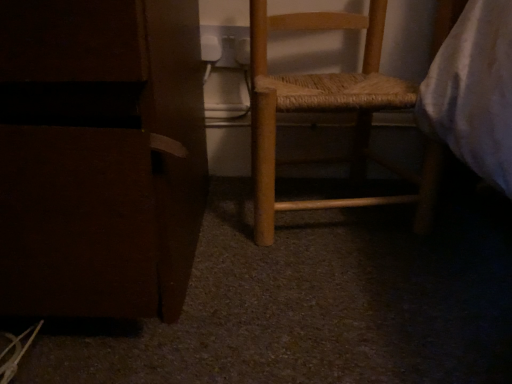
The width and height of the screenshot is (512, 384). Describe the element at coordinates (329, 111) in the screenshot. I see `wooden woven seat at center, marked as the 2th furniture in a left-to-right arrangement` at that location.

Locate an element on the screen. wooden woven seat at center, marked as the 2th furniture in a left-to-right arrangement is located at coordinates (329, 111).

Where is `matte brown cabinet at left, placed as the first furniture when sorted from left to right`? Image resolution: width=512 pixels, height=384 pixels. matte brown cabinet at left, placed as the first furniture when sorted from left to right is located at coordinates (100, 156).

Describe the element at coordinates (100, 156) in the screenshot. I see `matte brown cabinet at left, placed as the 2th furniture when sorted from right to left` at that location.

Where is `wooden woven seat at center, marked as the 2th furniture in a left-to-right arrangement`? The image size is (512, 384). wooden woven seat at center, marked as the 2th furniture in a left-to-right arrangement is located at coordinates (329, 111).

Consider the image. Is wooden woven seat at center, arranged as the 1th furniture when viewed from the right, to the left of matte brown cabinet at left, placed as the 2th furniture when sorted from right to left, from the viewer's perspective?

In fact, wooden woven seat at center, arranged as the 1th furniture when viewed from the right, is to the right of matte brown cabinet at left, placed as the 2th furniture when sorted from right to left.

In the image, is wooden woven seat at center, marked as the 2th furniture in a left-to-right arrangement, positioned in front of or behind matte brown cabinet at left, placed as the 2th furniture when sorted from right to left?

Clearly, wooden woven seat at center, marked as the 2th furniture in a left-to-right arrangement, is behind matte brown cabinet at left, placed as the 2th furniture when sorted from right to left.

Does point (410, 177) appear closer or farther from the camera than point (65, 222)?

Point (410, 177) appears to be farther away from the viewer than point (65, 222).

From the image's perspective, is wooden woven seat at center, arranged as the 1th furniture when viewed from the right, below matte brown cabinet at left, placed as the first furniture when sorted from left to right?

No, from the image's perspective, wooden woven seat at center, arranged as the 1th furniture when viewed from the right, is not beneath matte brown cabinet at left, placed as the first furniture when sorted from left to right.

From a real-world perspective, between wooden woven seat at center, arranged as the 1th furniture when viewed from the right, and matte brown cabinet at left, placed as the first furniture when sorted from left to right, who is vertically higher?

In real-world perspective, matte brown cabinet at left, placed as the first furniture when sorted from left to right, is above.

Which object is thinner, wooden woven seat at center, arranged as the 1th furniture when viewed from the right, or matte brown cabinet at left, placed as the first furniture when sorted from left to right?

wooden woven seat at center, arranged as the 1th furniture when viewed from the right, is thinner.

Which of these two, wooden woven seat at center, arranged as the 1th furniture when viewed from the right, or matte brown cabinet at left, placed as the 2th furniture when sorted from right to left, stands taller?

wooden woven seat at center, arranged as the 1th furniture when viewed from the right, is taller.

Considering the sizes of objects wooden woven seat at center, arranged as the 1th furniture when viewed from the right, and matte brown cabinet at left, placed as the first furniture when sorted from left to right, in the image provided, who is smaller, wooden woven seat at center, arranged as the 1th furniture when viewed from the right, or matte brown cabinet at left, placed as the first furniture when sorted from left to right,?

Smaller between the two is wooden woven seat at center, arranged as the 1th furniture when viewed from the right.

Do you think wooden woven seat at center, marked as the 2th furniture in a left-to-right arrangement, is within matte brown cabinet at left, placed as the first furniture when sorted from left to right, or outside of it?

wooden woven seat at center, marked as the 2th furniture in a left-to-right arrangement, is located beyond the bounds of matte brown cabinet at left, placed as the first furniture when sorted from left to right.

Is wooden woven seat at center, marked as the 2th furniture in a left-to-right arrangement, not close to matte brown cabinet at left, placed as the 2th furniture when sorted from right to left?

No, wooden woven seat at center, marked as the 2th furniture in a left-to-right arrangement, is not far from matte brown cabinet at left, placed as the 2th furniture when sorted from right to left.

Is wooden woven seat at center, arranged as the 1th furniture when viewed from the right, facing away from matte brown cabinet at left, placed as the first furniture when sorted from left to right?

That's not correct — wooden woven seat at center, arranged as the 1th furniture when viewed from the right, is not looking away from matte brown cabinet at left, placed as the first furniture when sorted from left to right.

How far apart are wooden woven seat at center, marked as the 2th furniture in a left-to-right arrangement, and matte brown cabinet at left, placed as the 2th furniture when sorted from right to left?

The distance of wooden woven seat at center, marked as the 2th furniture in a left-to-right arrangement, from matte brown cabinet at left, placed as the 2th furniture when sorted from right to left, is 10.80 inches.

This screenshot has width=512, height=384. I want to click on furniture on the right side of matte brown cabinet at left, placed as the 2th furniture when sorted from right to left, so click(329, 111).

Considering the positions of objects matte brown cabinet at left, placed as the first furniture when sorted from left to right, and wooden woven seat at center, arranged as the 1th furniture when viewed from the right, in the image provided, who is more to the right, matte brown cabinet at left, placed as the first furniture when sorted from left to right, or wooden woven seat at center, arranged as the 1th furniture when viewed from the right,?

Positioned to the right is wooden woven seat at center, arranged as the 1th furniture when viewed from the right.

Is matte brown cabinet at left, placed as the 2th furniture when sorted from right to left, in front of wooden woven seat at center, arranged as the 1th furniture when viewed from the right?

Yes, it is in front of wooden woven seat at center, arranged as the 1th furniture when viewed from the right.

Which point is more forward, (x=67, y=101) or (x=373, y=61)?

The point (x=67, y=101) is closer to the camera.

From the image's perspective, between matte brown cabinet at left, placed as the first furniture when sorted from left to right, and wooden woven seat at center, marked as the 2th furniture in a left-to-right arrangement, which one is located above?

wooden woven seat at center, marked as the 2th furniture in a left-to-right arrangement.

From a real-world perspective, which is physically above, matte brown cabinet at left, placed as the 2th furniture when sorted from right to left, or wooden woven seat at center, arranged as the 1th furniture when viewed from the right?

matte brown cabinet at left, placed as the 2th furniture when sorted from right to left, is physically above.

Considering the sizes of objects matte brown cabinet at left, placed as the 2th furniture when sorted from right to left, and wooden woven seat at center, marked as the 2th furniture in a left-to-right arrangement, in the image provided, who is wider, matte brown cabinet at left, placed as the 2th furniture when sorted from right to left, or wooden woven seat at center, marked as the 2th furniture in a left-to-right arrangement,?

Wider between the two is matte brown cabinet at left, placed as the 2th furniture when sorted from right to left.

Based on the photo, which of these two, matte brown cabinet at left, placed as the first furniture when sorted from left to right, or wooden woven seat at center, arranged as the 1th furniture when viewed from the right, stands taller?

wooden woven seat at center, arranged as the 1th furniture when viewed from the right.

Considering the sizes of matte brown cabinet at left, placed as the 2th furniture when sorted from right to left, and wooden woven seat at center, arranged as the 1th furniture when viewed from the right, in the image, is matte brown cabinet at left, placed as the 2th furniture when sorted from right to left, bigger or smaller than wooden woven seat at center, arranged as the 1th furniture when viewed from the right,?

matte brown cabinet at left, placed as the 2th furniture when sorted from right to left, is bigger than wooden woven seat at center, arranged as the 1th furniture when viewed from the right.

From the picture: Would you say matte brown cabinet at left, placed as the first furniture when sorted from left to right, is inside or outside wooden woven seat at center, marked as the 2th furniture in a left-to-right arrangement?

matte brown cabinet at left, placed as the first furniture when sorted from left to right, is outside wooden woven seat at center, marked as the 2th furniture in a left-to-right arrangement.

Would you consider matte brown cabinet at left, placed as the 2th furniture when sorted from right to left, to be distant from wooden woven seat at center, marked as the 2th furniture in a left-to-right arrangement?

They are positioned close to each other.

Consider the image. Is matte brown cabinet at left, placed as the first furniture when sorted from left to right, facing towards wooden woven seat at center, marked as the 2th furniture in a left-to-right arrangement?

No, matte brown cabinet at left, placed as the first furniture when sorted from left to right, does not turn towards wooden woven seat at center, marked as the 2th furniture in a left-to-right arrangement.

How different are the orientations of matte brown cabinet at left, placed as the first furniture when sorted from left to right, and wooden woven seat at center, marked as the 2th furniture in a left-to-right arrangement, in degrees?

The angle between the facing direction of matte brown cabinet at left, placed as the first furniture when sorted from left to right, and the facing direction of wooden woven seat at center, marked as the 2th furniture in a left-to-right arrangement, is 5.37 degrees.

How much distance is there between matte brown cabinet at left, placed as the 2th furniture when sorted from right to left, and wooden woven seat at center, arranged as the 1th furniture when viewed from the right?

27.44 centimeters.

At what (x,y) coordinates should I click in order to perform the action: click on furniture lying in front of the wooden woven seat at center, marked as the 2th furniture in a left-to-right arrangement. Please return your answer as a coordinate pair (x, y). Looking at the image, I should click on (100, 156).

Locate an element on the screen. This screenshot has width=512, height=384. furniture behind the matte brown cabinet at left, placed as the first furniture when sorted from left to right is located at coordinates (329, 111).

Find the location of `furniture that is in front of the wooden woven seat at center, marked as the 2th furniture in a left-to-right arrangement`. furniture that is in front of the wooden woven seat at center, marked as the 2th furniture in a left-to-right arrangement is located at coordinates (100, 156).